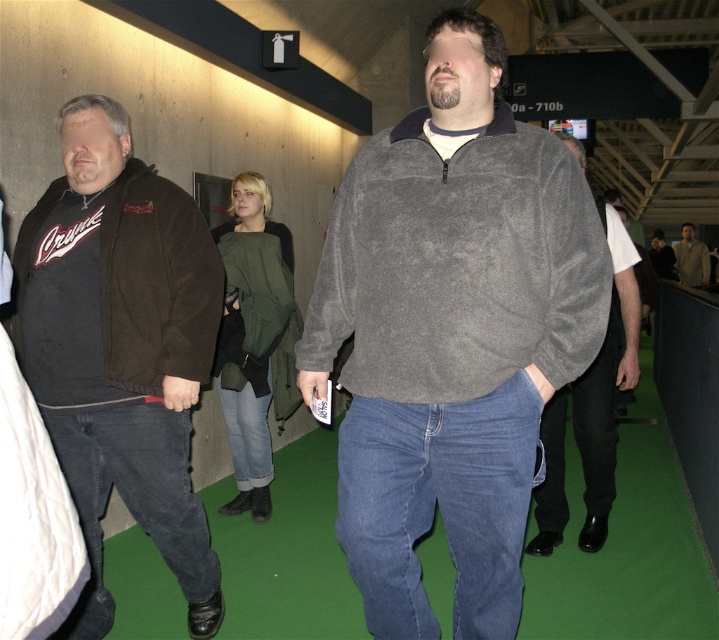
Question: Estimate the real-world distances between objects in this image. Which object is closer to the light beige sweater at right?

Choices:
 (A) blue denim jeans at lower center
 (B) brown fleece jacket at left
 (C) jeans at center

Answer: (A)

Question: Considering the relative positions of dark brown fleece sweatshirt at left and dark gray fleece at center in the image provided, where is dark brown fleece sweatshirt at left located with respect to dark gray fleece at center?

Choices:
 (A) below
 (B) above

Answer: (A)

Question: Which object is farther from the camera taking this photo?

Choices:
 (A) gray suede sweater at center
 (B) light beige sweater at right
 (C) gray suede sweatshirt at center
 (D) dark gray fleece at center

Answer: (B)

Question: Which point is farther to the camera?

Choices:
 (A) (523, 209)
 (B) (518, 212)
 (C) (127, 438)
 (D) (664, 268)

Answer: (D)

Question: Does dark blue corduroy jeans at lower left have a larger size compared to dark gray fleece at center?

Choices:
 (A) no
 (B) yes

Answer: (A)

Question: Can you confirm if gray suede sweatshirt at center is positioned to the left of jeans at center?

Choices:
 (A) yes
 (B) no

Answer: (B)